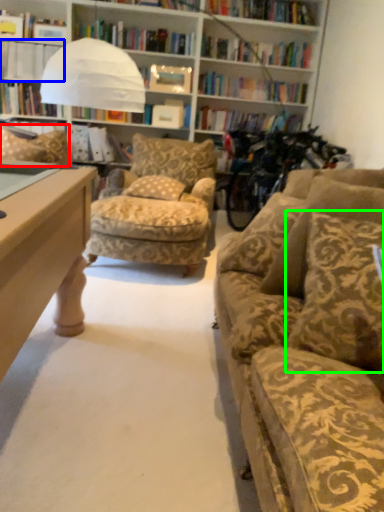
Question: Considering the real-world distances, which object is closest to pillow (highlighted by a red box)? book (highlighted by a blue box) or pillow (highlighted by a green box).

Choices:
 (A) book
 (B) pillow

Answer: (A)